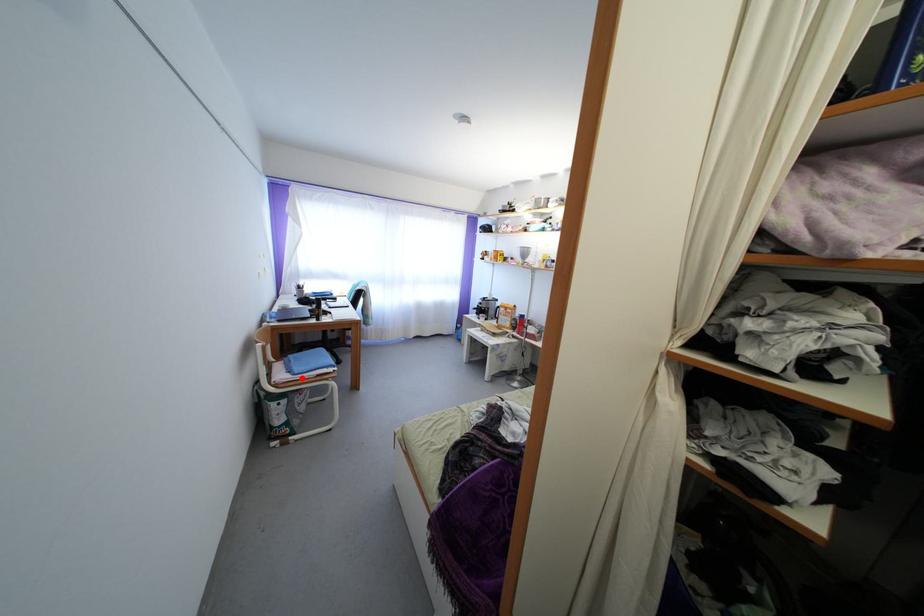
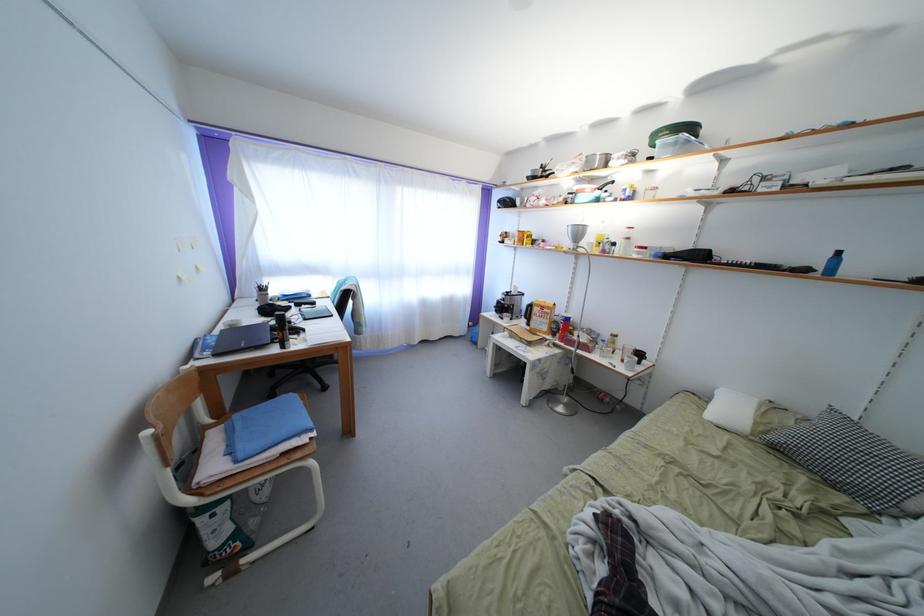
In the second image, find the point that corresponds to the highlighted location in the first image.

(247, 463)